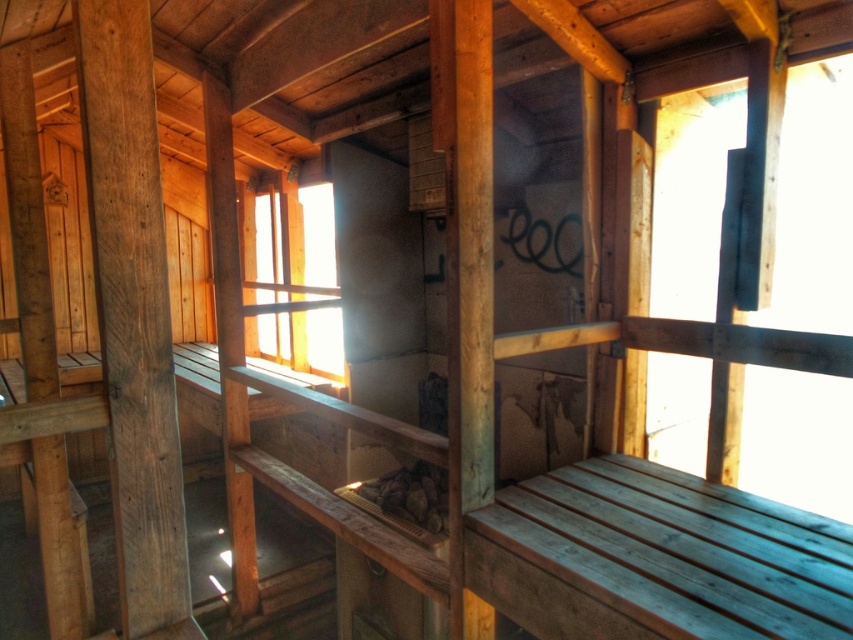
You are standing inside the wooden cabin and notice two points marked on the wall. The first point is at coordinates point (167, 595) and the second is at point (322, 317). Which point is closer to you?

Point (167, 595) is in front of point (322, 317), so it is closer to you.

You are standing in the wooden structure and want to exit through the nearest window. Which direction should you move towards to reach the transparent glass window at upper right represented by point (813, 202)?

The transparent glass window at upper right is located at point (813, 202), so you should move towards the upper right direction to reach it.

You are inside the wooden structure and want to see outside through the transparent glass window at upper right. Is the smooth brown wood beam at left blocking your view of the window?

The smooth brown wood beam at left is behind the transparent glass window at upper right, so it is not blocking your view of the window. You can see through the transparent glass window at upper right without obstruction from the beam.